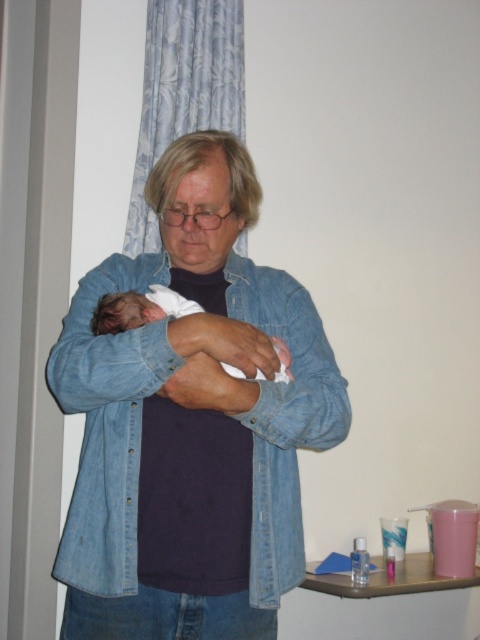
You are a delivery person who needs to place a package on the surface where the faded denim jacket at center is located. The package is 1 meter wide. Can you fit it there?

The faded denim jacket at center is 1.21 meters away from the viewer, but the question is about the surface where it is located. Since the distance provided does not indicate the surface width, we cannot determine if the package will fit. More information about the surface dimensions is needed.

You are standing in the room and want to place a 1.2 meter long ladder against the wall. The ladder must be placed exactly at point (298, 444). Is there enough space between you and the point to safely set up the ladder?

The distance between you and point (298, 444) is 1.32 meters. Since the ladder is 1.2 meters long, there is sufficient space to safely set it up.

You are a photographer adjusting the lighting in the scene. You need to ensure that both the faded denim jacket at center and the white soft newborn at center are evenly lit. Given their distance apart, what should you consider about the lighting setup?

The faded denim jacket at center is 6.09 inches from the white soft newborn at center. To evenly light both, ensure the lighting setup accounts for this close proximity, possibly using softboxes or diffusers to maintain even illumination without harsh shadows.